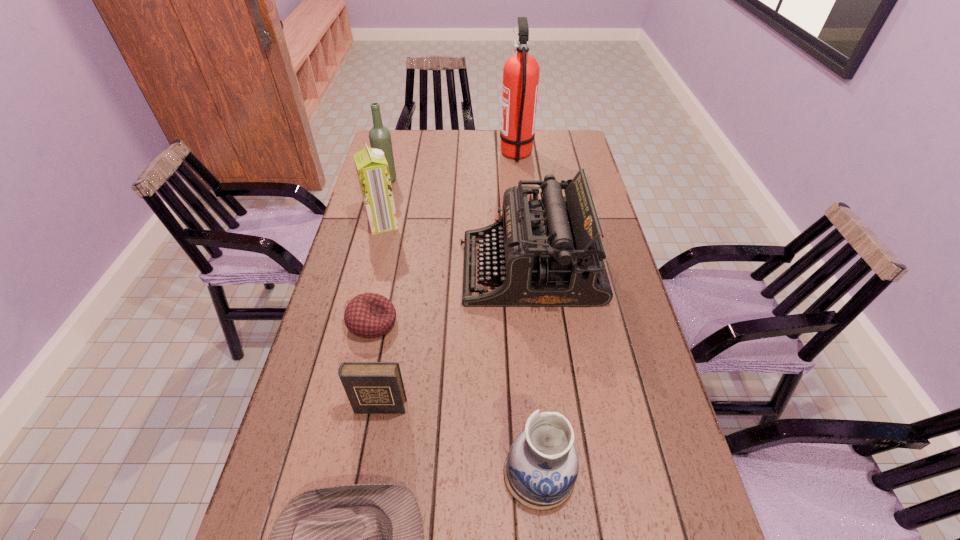
Locate an element on the screen. The height and width of the screenshot is (540, 960). vacant area that satisfies the following two spatial constraints: 1. on the handle side of the farthest object; 2. on the front cover of the diary is located at coordinates (544, 407).